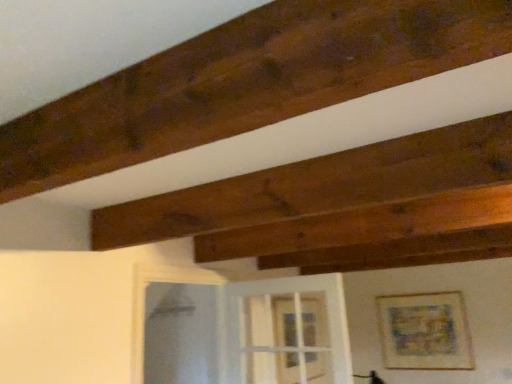
Question: From a real-world perspective, is transparent glass door at center above or below clear glass screen door at lower center?

Choices:
 (A) above
 (B) below

Answer: (B)

Question: From the image's perspective, is transparent glass door at center located above or below clear glass screen door at lower center?

Choices:
 (A) above
 (B) below

Answer: (B)

Question: Which object is positioned closest to the clear glass screen door at lower center?

Choices:
 (A) transparent glass door at center
 (B) matte wooden picture frame at upper right

Answer: (A)

Question: Which is nearer to the clear glass screen door at lower center?

Choices:
 (A) matte wooden picture frame at upper right
 (B) transparent glass door at center

Answer: (B)